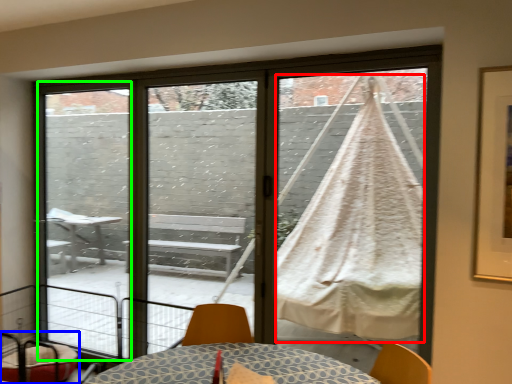
Question: Based on their relative distances, which object is farther from blanket (highlighted by a red box)? Choose from furniture (highlighted by a blue box) and screen door (highlighted by a green box).

Choices:
 (A) furniture
 (B) screen door

Answer: (A)